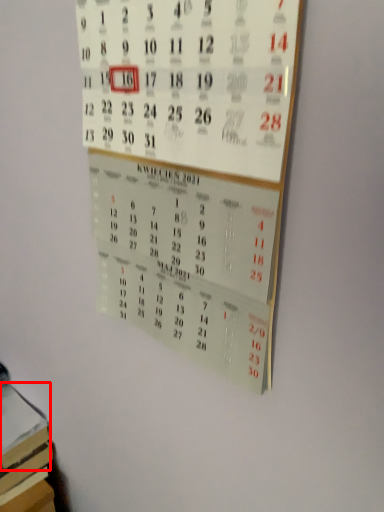
Question: In this image, where is book (annotated by the red box) located relative to bulletin board?

Choices:
 (A) right
 (B) left

Answer: (B)